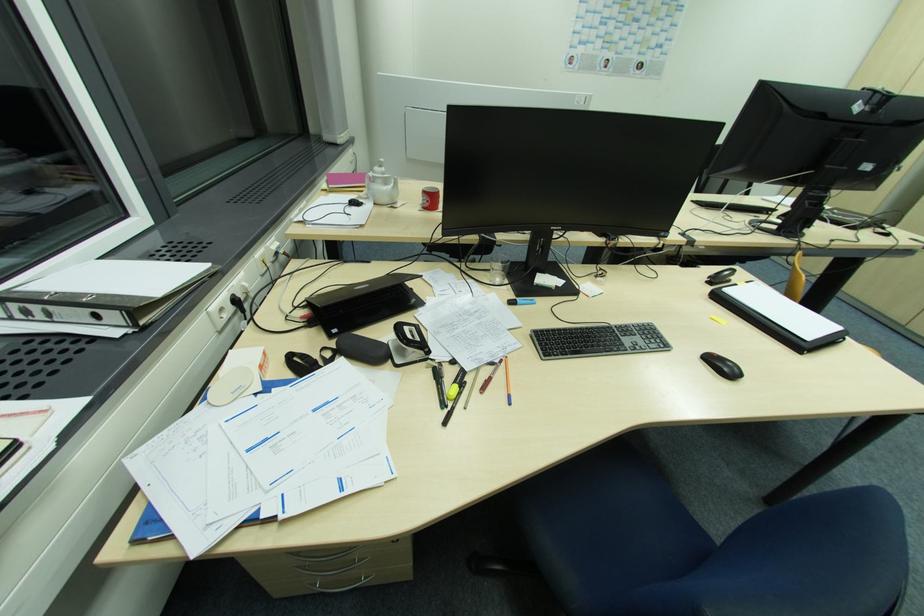
Locate an element on the screen. binder ring lever is located at coordinates (410, 336).